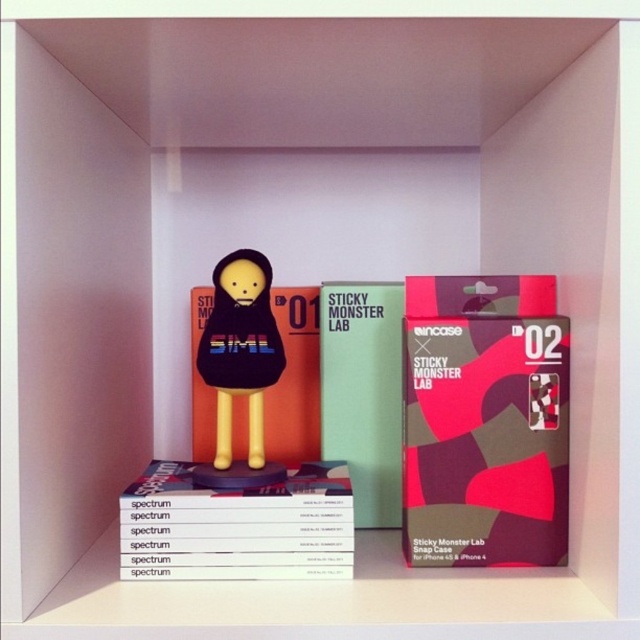
Between matte pink box at center and matte black figure at center, which one is positioned lower?

matte pink box at center

Based on the photo, is matte pink box at center bigger than matte black figure at center?

Incorrect, matte pink box at center is not larger than matte black figure at center.

Locate an element on the screen. Image resolution: width=640 pixels, height=640 pixels. matte pink box at center is located at coordinates (x=484, y=442).

From the picture: Who is positioned more to the right, white paper book at center or matte black figure at center?

white paper book at center

Does white paper book at center have a lesser height compared to matte black figure at center?

Yes, white paper book at center is shorter than matte black figure at center.

Describe the element at coordinates (237, 525) in the screenshot. I see `white paper book at center` at that location.

Identify the location of white paper book at center. The image size is (640, 640). (237, 525).

The width and height of the screenshot is (640, 640). What do you see at coordinates (364, 392) in the screenshot?
I see `green matte book at center` at bounding box center [364, 392].

Is green matte book at center smaller than matte black figure at center?

Indeed, green matte book at center has a smaller size compared to matte black figure at center.

Find the location of a particular element. This screenshot has height=640, width=640. green matte book at center is located at coordinates (364, 392).